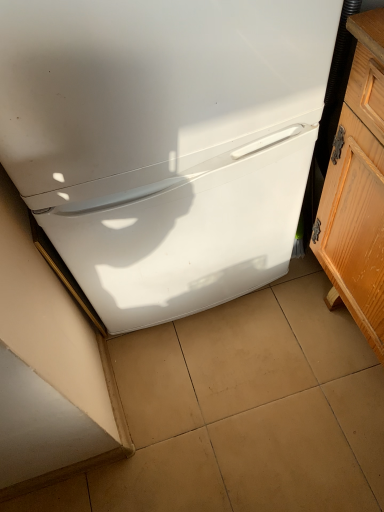
At what (x,y) coordinates should I click in order to perform the action: click on empty space that is ontop of beige tile at center (from a real-world perspective). Please return your answer as a coordinate pair (x, y). This screenshot has height=512, width=384. Looking at the image, I should click on (220, 402).